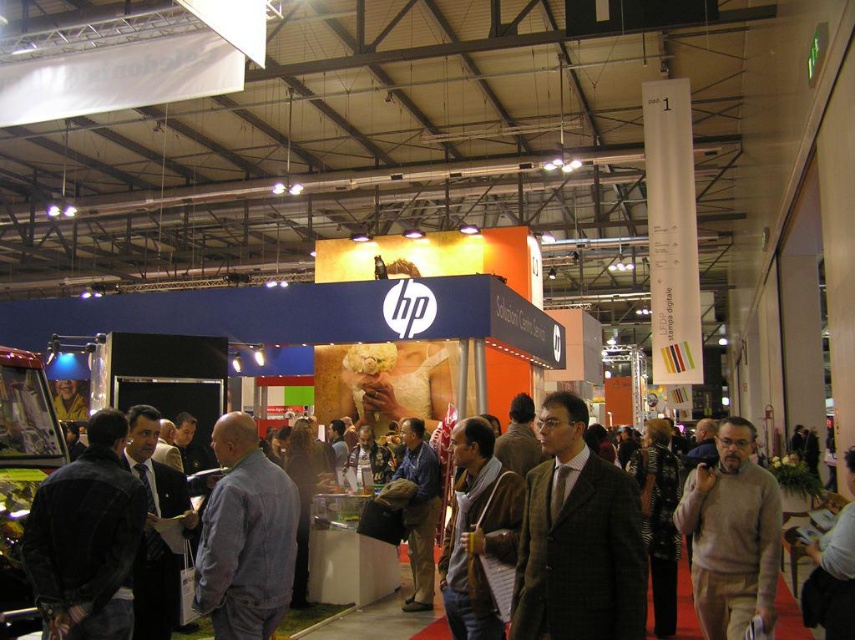
Question: Estimate the real-world distances between objects in this image. Which object is farther from the brown wool suit at center?

Choices:
 (A) blue denim shirt at center
 (B) gray sweater at center

Answer: (A)

Question: From the image, what is the correct spatial relationship of brown wool suit at center in relation to dark blue denim jacket at left?

Choices:
 (A) above
 (B) below

Answer: (A)

Question: Does gray sweater at center appear on the right side of blue denim shirt at center?

Choices:
 (A) yes
 (B) no

Answer: (A)

Question: Which point is farther from the camera taking this photo?

Choices:
 (A) (727, 513)
 (B) (122, 525)

Answer: (A)

Question: Which object is positioned farthest from the denim jacket at center?

Choices:
 (A) brown wool suit at center
 (B) dark blue denim jacket at left
 (C) knitted sweater at center

Answer: (A)

Question: Is gray sweater at center positioned at the back of knitted sweater at center?

Choices:
 (A) yes
 (B) no

Answer: (A)